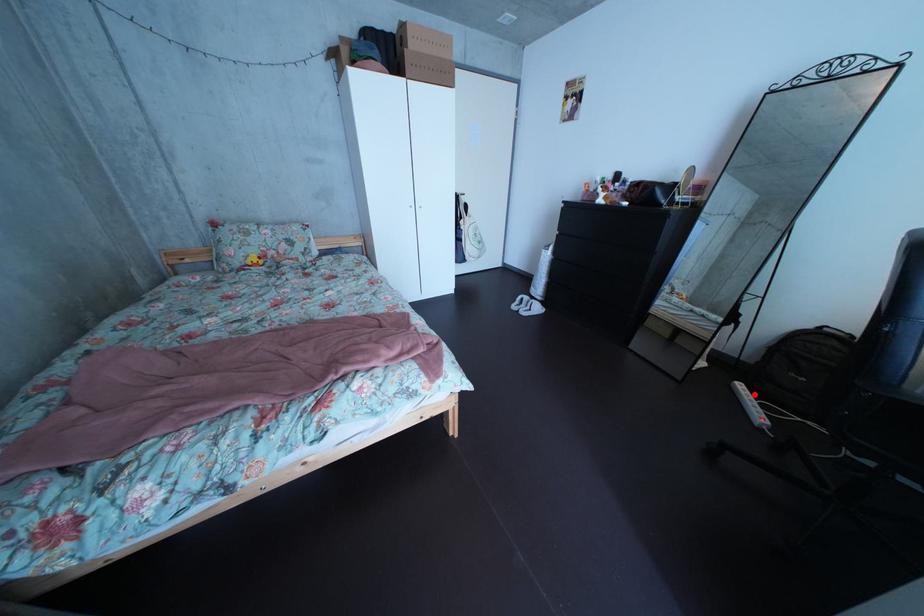
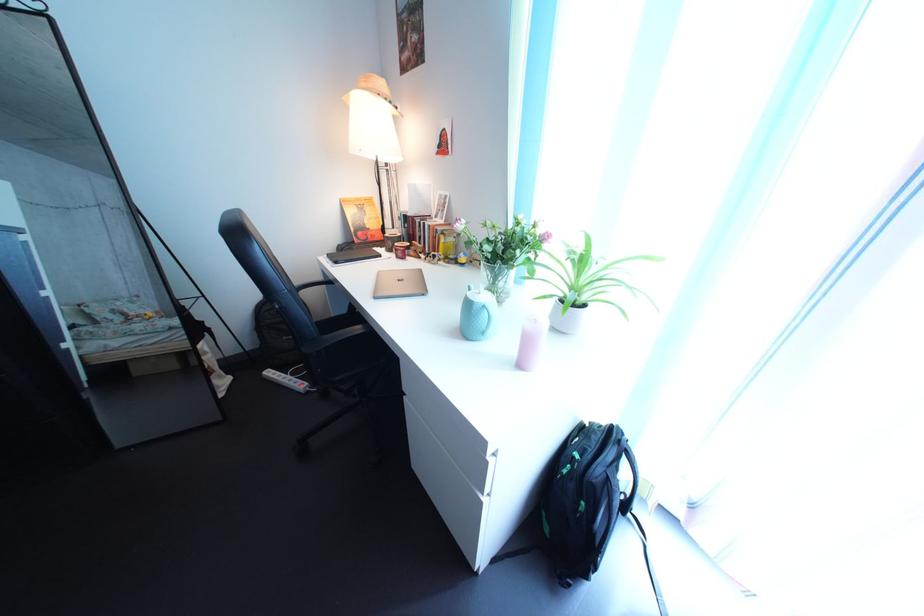
Locate, in the second image, the point that corresponds to the highlighted location in the first image.

(284, 381)